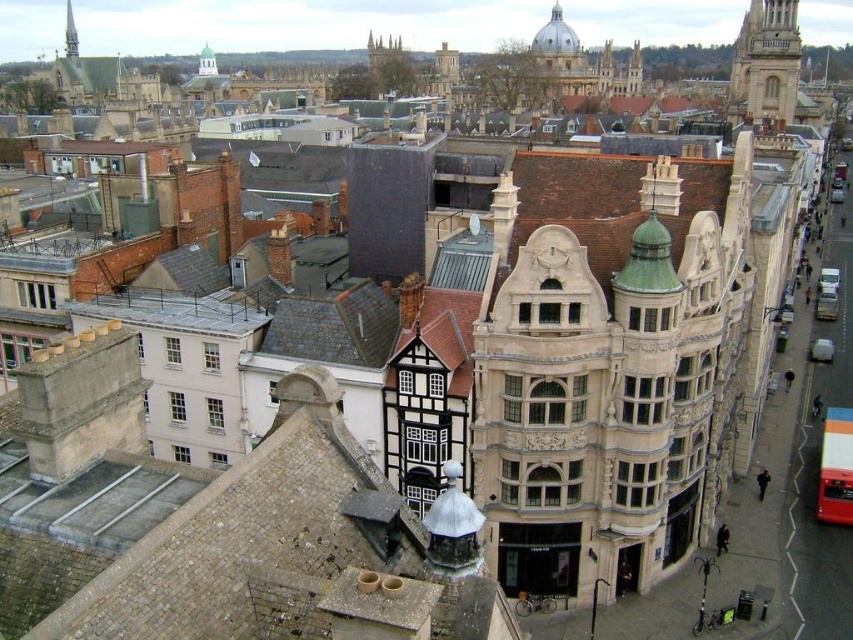
Consider the image. Is beige stone building at center taller than smooth silver spire at upper left?

No.

Which is in front, point (483, 436) or point (73, 32)?

Point (483, 436)

Where is `beige stone building at center`? This screenshot has height=640, width=853. beige stone building at center is located at coordinates (606, 362).

Between point (741, 72) and point (74, 60), which one is positioned in front?

Point (741, 72)

Looking at this image, which is more to the right, stone tower at upper right or smooth silver spire at upper left?

stone tower at upper right is more to the right.

Does point (733, 93) come closer to viewer compared to point (67, 40)?

Yes, it is.

What are the coordinates of `stone tower at upper right` in the screenshot? It's located at (764, 61).

Is beige stone building at center further to the viewer compared to stone tower at upper right?

That is False.

Which is more to the left, beige stone building at center or stone tower at upper right?

beige stone building at center

Between point (581, 289) and point (758, 16), which one is positioned behind?

Point (758, 16)

At what (x,y) coordinates should I click in order to perform the action: click on beige stone building at center. Please return your answer as a coordinate pair (x, y). The width and height of the screenshot is (853, 640). Looking at the image, I should click on (606, 362).